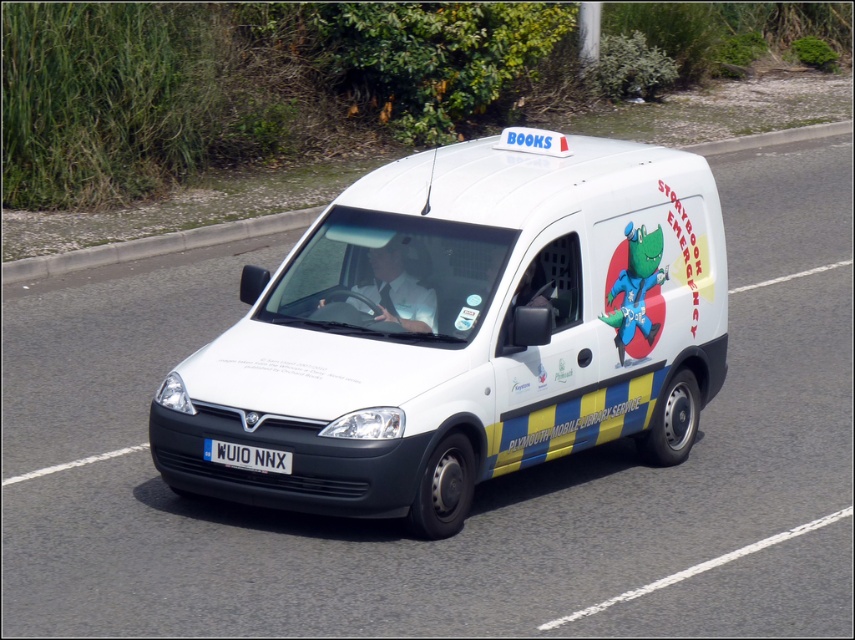
You are a delivery driver who needs to park your vehicle next to the white matte van at center. The parking space available is only 1.5 meters wide. Can you safely park your vehicle there without hitting the white plastic license plate at center?

The white matte van at center is wider than the white plastic license plate at center. Since the parking space is 1.5 meters wide, you need to check if the van itself fits. However, the license plate width is not directly relevant to the parking space width. Without knowing the van and parking space dimensions, it is uncertain. Please verify the van width against the parking space.

Based on the photo, you are a pedestrian standing on the sidewalk next to the road. You see the white matte van at center and the white plastic license plate at center. Which one is closer to you?

The white matte van at center is closer to you because it is in front of the white plastic license plate at center.